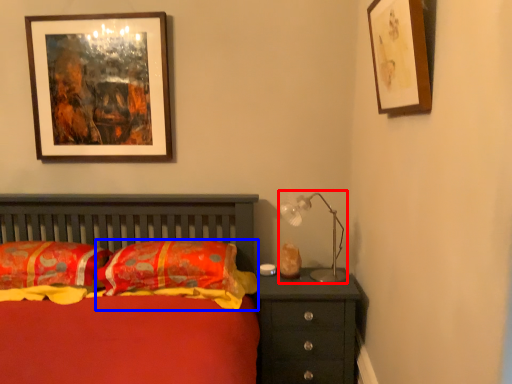
Question: Among these objects, which one is farthest to the camera, table lamp (highlighted by a red box) or pillow (highlighted by a blue box)?

Choices:
 (A) table lamp
 (B) pillow

Answer: (A)